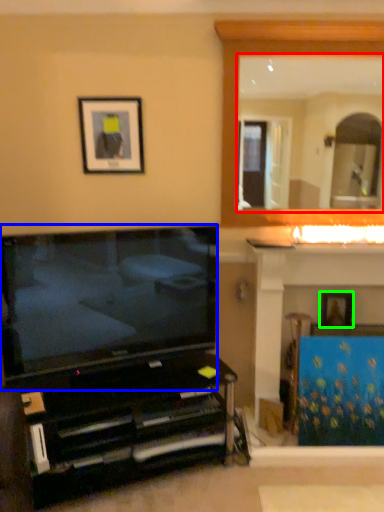
Question: Estimate the real-world distances between objects in this image. Which object is closer to mirror (highlighted by a red box), television (highlighted by a blue box) or picture frame (highlighted by a green box)?

Choices:
 (A) television
 (B) picture frame

Answer: (A)